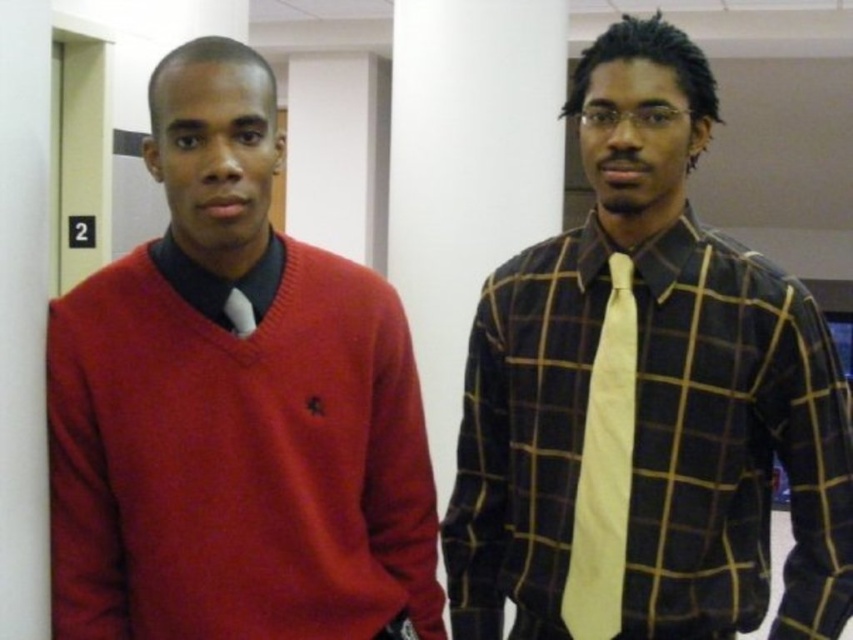
Between plaid cotton shirt at center and yellow silk tie at right, which one appears on the left side from the viewer's perspective?

Positioned to the left is yellow silk tie at right.

Is plaid cotton shirt at center below yellow silk tie at right?

Actually, plaid cotton shirt at center is above yellow silk tie at right.

What do you see at coordinates (646, 400) in the screenshot? This screenshot has height=640, width=853. I see `plaid cotton shirt at center` at bounding box center [646, 400].

At what (x,y) coordinates should I click in order to perform the action: click on plaid cotton shirt at center. Please return your answer as a coordinate pair (x, y). The height and width of the screenshot is (640, 853). Looking at the image, I should click on (646, 400).

Who is more distant from viewer, (235, 108) or (582, 512)?

The point (582, 512) is behind.

The width and height of the screenshot is (853, 640). What do you see at coordinates (233, 406) in the screenshot?
I see `matte red sweater at left` at bounding box center [233, 406].

Where is `matte red sweater at left`? matte red sweater at left is located at coordinates (233, 406).

Is plaid cotton shirt at center to the left of matte red sweater at left from the viewer's perspective?

No, plaid cotton shirt at center is not to the left of matte red sweater at left.

Who is shorter, plaid cotton shirt at center or matte red sweater at left?

Standing shorter between the two is matte red sweater at left.

Who is more forward, (523, 349) or (326, 451)?

Point (326, 451) is in front.

I want to click on plaid cotton shirt at center, so click(646, 400).